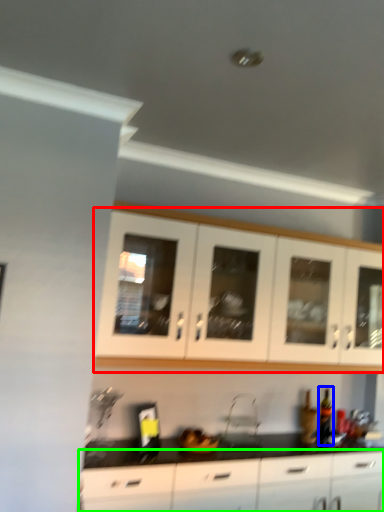
Question: Which object is positioned farthest from cabinetry (highlighted by a red box)? Select from bottle (highlighted by a blue box) and cabinetry (highlighted by a green box).

Choices:
 (A) bottle
 (B) cabinetry

Answer: (A)